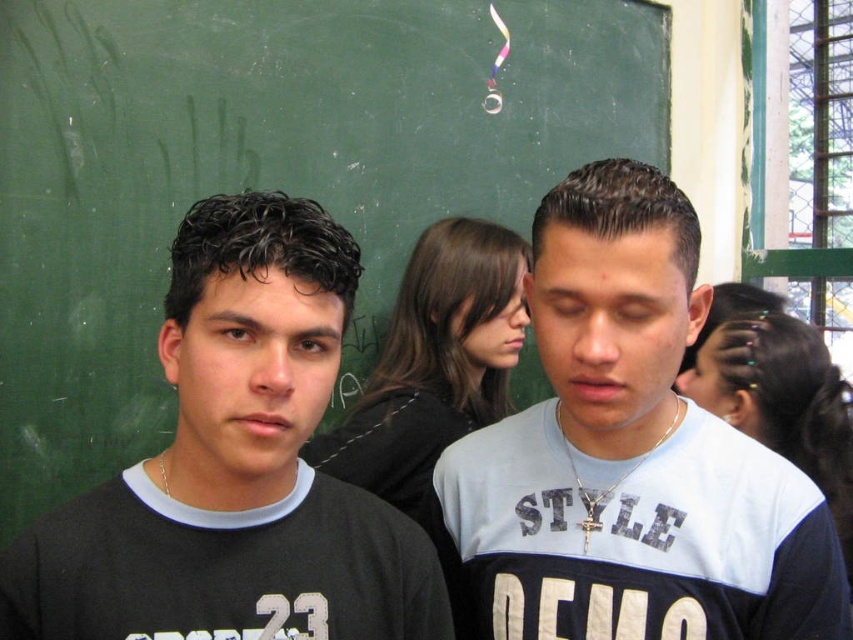
Does green chalkboard at upper center appear on the right side of white matte shirt at center?

No, green chalkboard at upper center is not to the right of white matte shirt at center.

I want to click on green chalkboard at upper center, so click(x=263, y=172).

This screenshot has height=640, width=853. In order to click on green chalkboard at upper center in this screenshot , I will do `click(263, 172)`.

Between green chalkboard at upper center and black matte shirt at center, which one has more height?

Standing taller between the two is green chalkboard at upper center.

From the picture: Is green chalkboard at upper center below black matte shirt at center?

Incorrect, green chalkboard at upper center is not positioned below black matte shirt at center.

Does point (526, 198) come closer to viewer compared to point (334, 349)?

No, (526, 198) is behind (334, 349).

Find the location of `green chalkboard at upper center`. green chalkboard at upper center is located at coordinates (263, 172).

Is white matte shirt at center bigger than black matte shirt at center?

Yes.

Between point (616, 344) and point (196, 205), which one is positioned in front?

Point (616, 344)

Image resolution: width=853 pixels, height=640 pixels. Identify the location of white matte shirt at center. pyautogui.click(x=628, y=456).